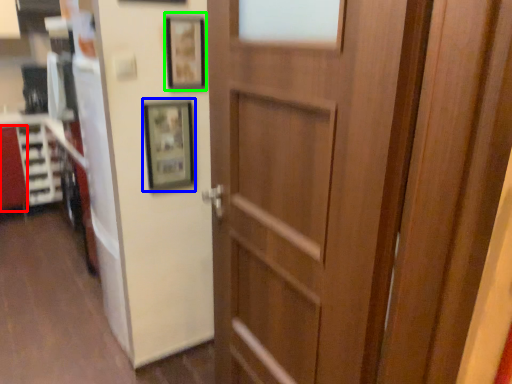
Question: Based on their relative distances, which object is nearer to cabinetry (highlighted by a red box)? Choose from picture frame (highlighted by a blue box) and picture frame (highlighted by a green box).

Choices:
 (A) picture frame
 (B) picture frame

Answer: (A)